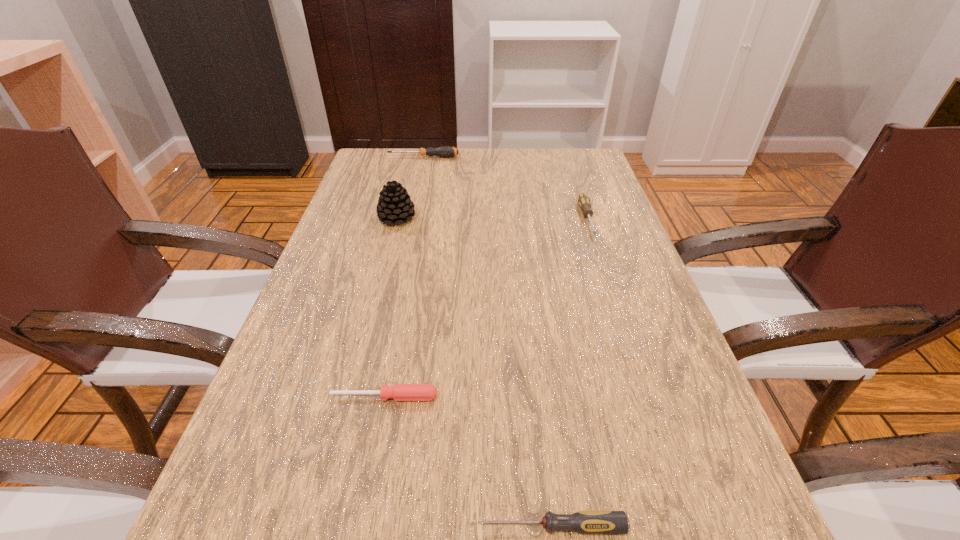
The height and width of the screenshot is (540, 960). Identify the location of vacant space that's between the pinecone and the second nearest object. (391, 307).

In order to click on free spot between the second object from right to left and the farthest screwdriver in this screenshot , I will do `click(487, 342)`.

Identify the location of vacant space that is in between the nearest object and the rightmost object. The height and width of the screenshot is (540, 960). (569, 373).

Locate which object ranks in proximity to the pinecone. Please provide its 2D coordinates. Your answer should be formatted as a tuple, i.e. [(x, y)], where the tuple contains the x and y coordinates of a point satisfying the conditions above.

[(446, 151)]

This screenshot has width=960, height=540. I want to click on object identified as the fourth closest to the tallest object, so click(584, 522).

Where is `screwdriver that is the second closest to the fourth object from left to right`? This screenshot has width=960, height=540. screwdriver that is the second closest to the fourth object from left to right is located at coordinates (583, 200).

Find the location of a particular element. The height and width of the screenshot is (540, 960). screwdriver that is the second nearest to the farthest object is located at coordinates (400, 392).

The height and width of the screenshot is (540, 960). What are the coordinates of `vacant region that satisfies the following two spatial constraints: 1. at the narrow end of the tallest object; 2. on the left side of the second nearest screwdriver` in the screenshot? It's located at (351, 397).

At what (x,y) coordinates should I click in order to perform the action: click on free location that satisfies the following two spatial constraints: 1. on the front side of the farthest object; 2. on the left side of the third farthest screwdriver. Please return your answer as a coordinate pair (x, y). Looking at the image, I should click on (372, 397).

You are a GUI agent. You are given a task and a screenshot of the screen. Output one action in this format:
    pyautogui.click(x=<x>, y=<y>)
    Task: Click on the vacant space that satisfies the following two spatial constraints: 1. at the tip of the rightmost object; 2. insert the nearest screwdriver into a screw head
    
    Given the screenshot: What is the action you would take?
    pyautogui.click(x=688, y=526)